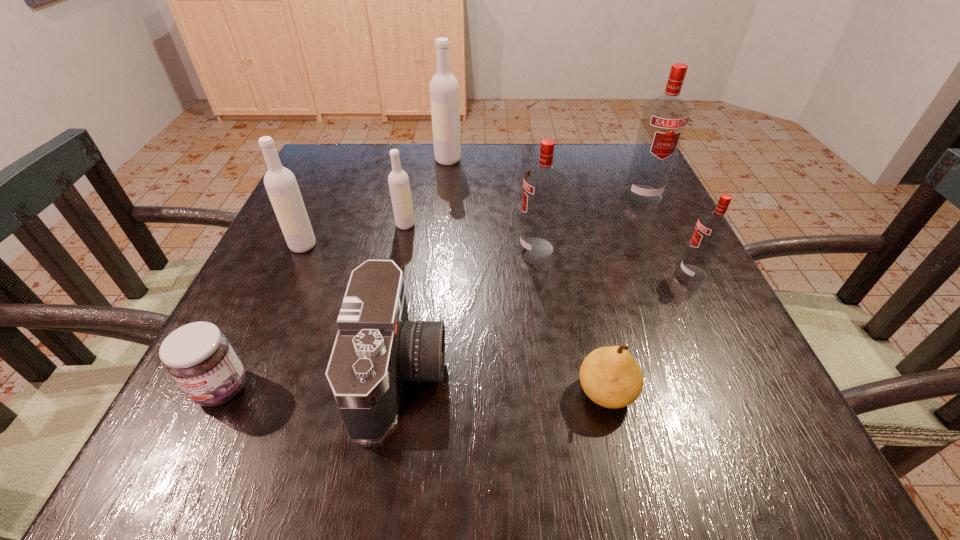
Image resolution: width=960 pixels, height=540 pixels. What are the coordinates of `the second nearest white vodka` in the screenshot? It's located at (398, 180).

You are a GUI agent. You are given a task and a screenshot of the screen. Output one action in this format:
    pyautogui.click(x=<x>, y=<y>)
    Task: Click on the smallest white vodka
    This screenshot has width=960, height=540.
    Given the screenshot: What is the action you would take?
    pyautogui.click(x=398, y=180)

At what (x,y) coordinates should I click in order to perform the action: click on black camera. Please return your answer as a coordinate pair (x, y). The width and height of the screenshot is (960, 540). Looking at the image, I should click on (377, 348).

Locate an element on the screen. pear is located at coordinates (610, 376).

In order to click on jam in this screenshot , I will do `click(199, 357)`.

You are a GUI agent. You are given a task and a screenshot of the screen. Output one action in this format:
    pyautogui.click(x=<x>, y=<y>)
    Task: Click on the vacant space located on the left of the farthest vodka
    
    Given the screenshot: What is the action you would take?
    (x=364, y=160)

I want to click on free location located on the front label of the second farthest object, so click(710, 340).

In order to click on vacant area situated on the front label of the leftmost red vodka in this screenshot , I will do `click(461, 248)`.

Identify the location of free space located 0.380m on the front label of the leftmost red vodka. point(335,248).

Locate an element on the screen. vacant space located 0.080m on the front label of the leftmost red vodka is located at coordinates (480, 248).